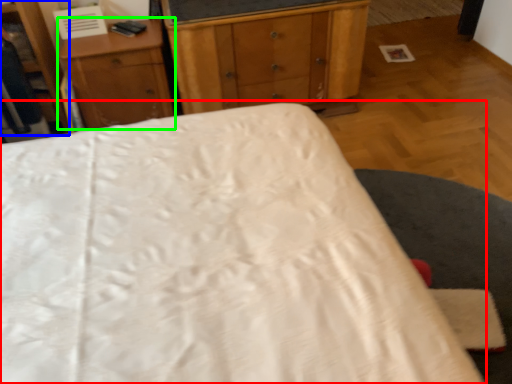
Question: Which is nearer to the bed (highlighted by a red box)? dresser (highlighted by a blue box) or nightstand (highlighted by a green box).

Choices:
 (A) dresser
 (B) nightstand

Answer: (B)